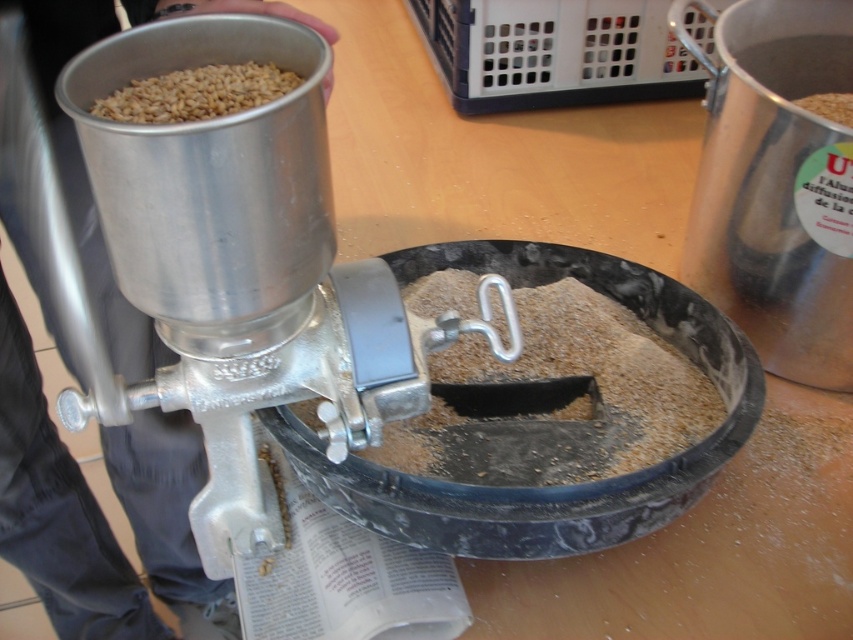
Question: Is the position of brown matte grain at center more distant than that of golden matte grains at upper left?

Choices:
 (A) no
 (B) yes

Answer: (B)

Question: Can you confirm if brown matte grain at center is thinner than golden matte grains at upper left?

Choices:
 (A) no
 (B) yes

Answer: (A)

Question: Among these points, which one is farthest from the camera?

Choices:
 (A) (206, 118)
 (B) (547, 413)

Answer: (B)

Question: Which point is farther to the camera?

Choices:
 (A) brown matte grain at center
 (B) golden matte grains at upper left

Answer: (A)

Question: Can you confirm if brown matte grain at center is positioned below golden matte grains at upper left?

Choices:
 (A) no
 (B) yes

Answer: (B)